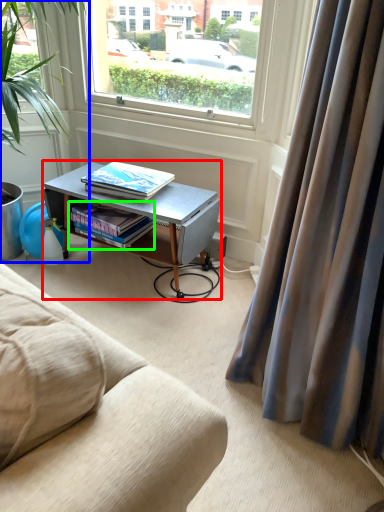
Question: Considering the real-world distances, which object is closest to desk (highlighted by a red box)? houseplant (highlighted by a blue box) or book (highlighted by a green box).

Choices:
 (A) houseplant
 (B) book

Answer: (B)